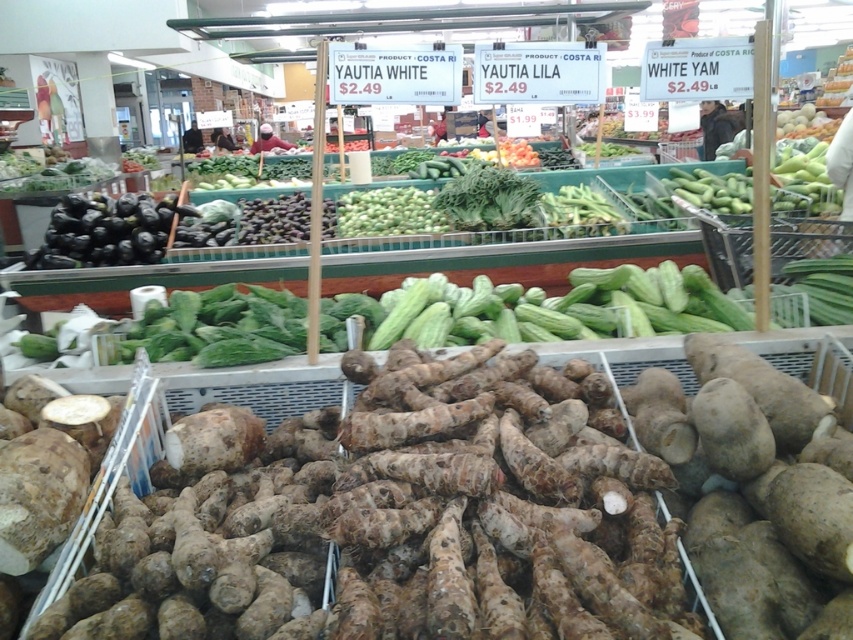
Question: Which point appears farthest from the camera in this image?

Choices:
 (A) (64, 204)
 (B) (412, 188)

Answer: (B)

Question: Is black matte eggplant at left above green matte cucumbers at center?

Choices:
 (A) no
 (B) yes

Answer: (A)

Question: Does black matte eggplant at left appear on the right side of green matte cucumbers at center?

Choices:
 (A) yes
 (B) no

Answer: (B)

Question: Which point appears farthest from the camera in this image?

Choices:
 (A) (341, 198)
 (B) (177, 208)

Answer: (A)

Question: Considering the relative positions of black matte eggplant at left and green matte cucumbers at center in the image provided, where is black matte eggplant at left located with respect to green matte cucumbers at center?

Choices:
 (A) above
 (B) below

Answer: (B)